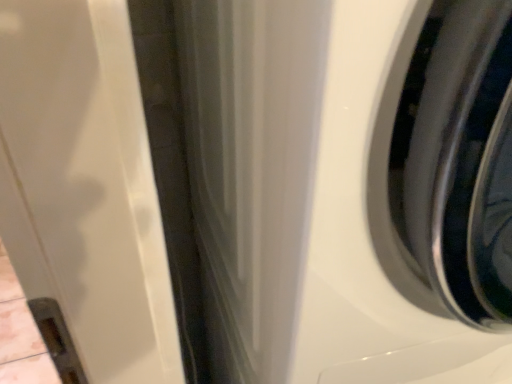
Question: From the image's perspective, is white glossy washing machine at right above or below metallic silver wheel at center right?

Choices:
 (A) below
 (B) above

Answer: (A)

Question: Is white glossy washing machine at right in front of or behind metallic silver wheel at center right in the image?

Choices:
 (A) front
 (B) behind

Answer: (A)

Question: Is point (331, 183) positioned closer to the camera than point (451, 297)?

Choices:
 (A) closer
 (B) farther

Answer: (A)

Question: Considering the relative positions of metallic silver wheel at center right and white glossy washing machine at right in the image provided, is metallic silver wheel at center right to the left or to the right of white glossy washing machine at right?

Choices:
 (A) left
 (B) right

Answer: (B)

Question: From their relative heights in the image, would you say metallic silver wheel at center right is taller or shorter than white glossy washing machine at right?

Choices:
 (A) tall
 (B) short

Answer: (B)

Question: Considering the positions of metallic silver wheel at center right and white glossy washing machine at right in the image, is metallic silver wheel at center right wider or thinner than white glossy washing machine at right?

Choices:
 (A) wide
 (B) thin

Answer: (B)

Question: From a real-world perspective, is metallic silver wheel at center right positioned above or below white glossy washing machine at right?

Choices:
 (A) above
 (B) below

Answer: (B)